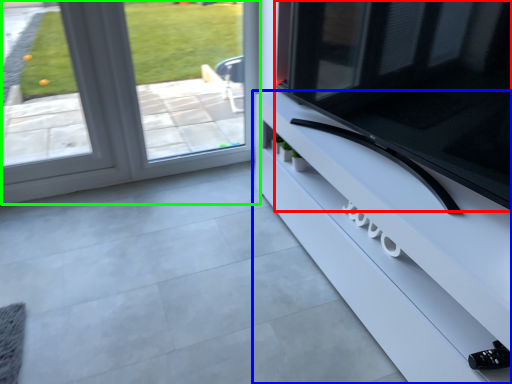
Question: Which object is positioned farthest from television (highlighted by a red box)? Select from furniture (highlighted by a blue box) and window (highlighted by a green box).

Choices:
 (A) furniture
 (B) window

Answer: (B)